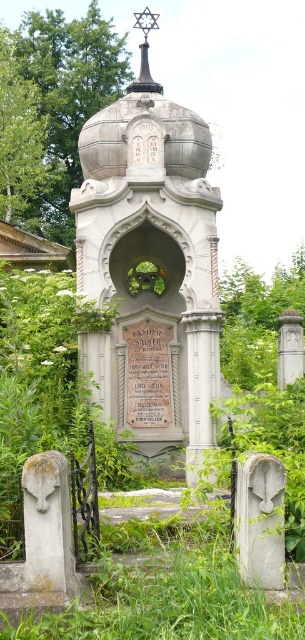
Can you confirm if polished stone monument at center is positioned to the left of green leafy tree at upper left?

Incorrect, polished stone monument at center is not on the left side of green leafy tree at upper left.

Between point (146, 454) and point (3, 166), which one is positioned behind?

The point (3, 166) is more distant.

Locate an element on the screen. The height and width of the screenshot is (640, 305). polished stone monument at center is located at coordinates (150, 266).

Is the position of polished stone monument at center less distant than that of green leafy tree at upper center?

Yes.

Does polished stone monument at center have a lesser width compared to green leafy tree at upper center?

Yes.

Between point (100, 109) and point (35, 106), which one is positioned in front?

Point (35, 106) is in front.

Locate an element on the screen. The height and width of the screenshot is (640, 305). polished stone monument at center is located at coordinates (150, 266).

Is green leafy tree at upper center taller than green leafy tree at upper left?

Indeed, green leafy tree at upper center has a greater height compared to green leafy tree at upper left.

Does point (70, 168) lie in front of point (17, 125)?

No, (70, 168) is behind (17, 125).

Between point (47, 108) and point (7, 144), which one is positioned in front?

Point (7, 144) is more forward.

Where is `green leafy tree at upper center`? The width and height of the screenshot is (305, 640). green leafy tree at upper center is located at coordinates (51, 109).